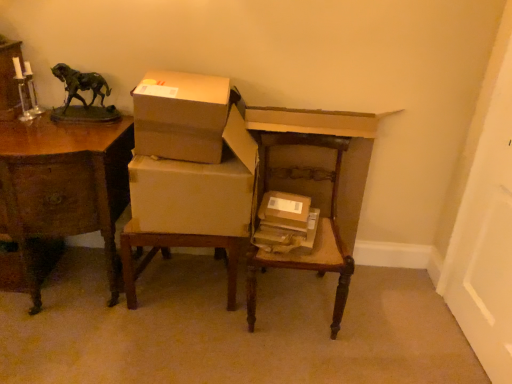
Question: Can you confirm if brown cardboard box at center, which ranks as the 2th box in top-to-bottom order, is taller than brown cardboard box at upper center, which ranks as the first box in left-to-right order?

Choices:
 (A) no
 (B) yes

Answer: (A)

Question: Is brown cardboard box at center, the first box when ordered from bottom to top, turned away from brown cardboard box at upper center, acting as the second box starting from the bottom?

Choices:
 (A) no
 (B) yes

Answer: (A)

Question: Can you confirm if brown cardboard box at center, which appears as the 2th box when viewed from the left, is thinner than brown cardboard box at upper center, which ranks as the first box in left-to-right order?

Choices:
 (A) no
 (B) yes

Answer: (B)

Question: From the image's perspective, is brown cardboard box at center, which appears as the 2th box when viewed from the left, beneath brown cardboard box at upper center, which ranks as the first box in left-to-right order?

Choices:
 (A) no
 (B) yes

Answer: (B)

Question: Is brown cardboard box at center, positioned as the 1th box in right-to-left order, facing towards brown cardboard box at upper center, which ranks as the first box in left-to-right order?

Choices:
 (A) yes
 (B) no

Answer: (B)

Question: Is brown cardboard box at center, which appears as the 2th box when viewed from the left, located outside brown cardboard box at upper center, the 1th box in the top-to-bottom sequence?

Choices:
 (A) no
 (B) yes

Answer: (B)

Question: Is brown cardboard box at center aimed at brown cardboard box at center, positioned as the 1th box in right-to-left order?

Choices:
 (A) yes
 (B) no

Answer: (B)

Question: Considering the relative sizes of brown cardboard box at center and brown cardboard box at center, which ranks as the 2th box in top-to-bottom order, in the image provided, is brown cardboard box at center shorter than brown cardboard box at center, which ranks as the 2th box in top-to-bottom order,?

Choices:
 (A) yes
 (B) no

Answer: (B)

Question: Is brown cardboard box at center at the right side of brown cardboard box at center, which appears as the 2th box when viewed from the left?

Choices:
 (A) no
 (B) yes

Answer: (B)

Question: Can you confirm if brown cardboard box at center is taller than brown cardboard box at center, the first box when ordered from bottom to top?

Choices:
 (A) yes
 (B) no

Answer: (A)

Question: Are brown cardboard box at center and brown cardboard box at center, the first box when ordered from bottom to top, beside each other?

Choices:
 (A) no
 (B) yes

Answer: (B)

Question: From the image's perspective, is brown cardboard box at center over brown cardboard box at center, positioned as the 1th box in right-to-left order?

Choices:
 (A) yes
 (B) no

Answer: (B)

Question: Does brown cardboard box at center, which appears as the 2th box when viewed from the left, have a greater height compared to green patina bronze horse at upper left?

Choices:
 (A) no
 (B) yes

Answer: (A)